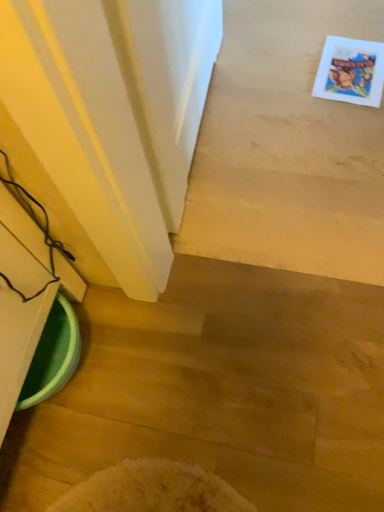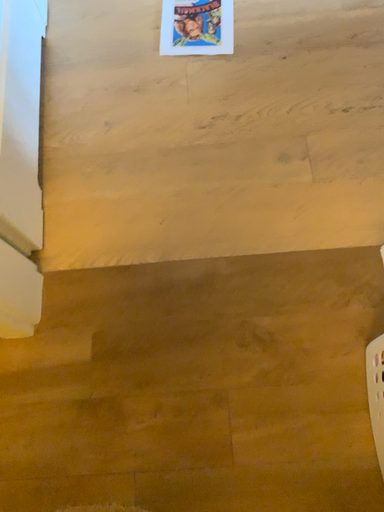
Question: How did the camera likely rotate when shooting the video?

Choices:
 (A) rotated right
 (B) rotated left

Answer: (A)